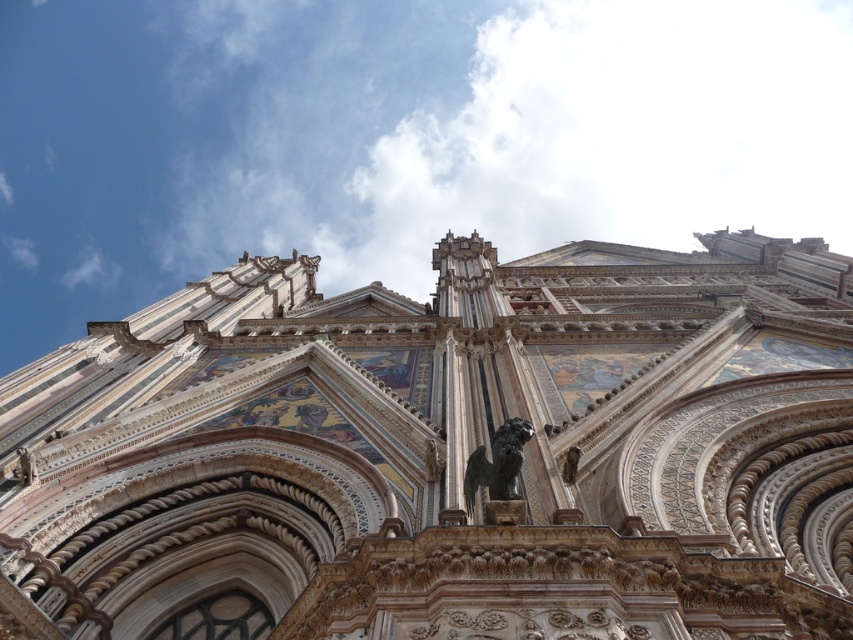
Question: Can you confirm if white marble church at center is thinner than bronze statue at center?

Choices:
 (A) no
 (B) yes

Answer: (A)

Question: Is white marble church at center smaller than bronze statue at center?

Choices:
 (A) yes
 (B) no

Answer: (B)

Question: Which point appears farthest from the camera in this image?

Choices:
 (A) (602, 442)
 (B) (503, 480)

Answer: (A)

Question: In this image, where is white marble church at center located relative to bronze statue at center?

Choices:
 (A) right
 (B) left

Answer: (A)